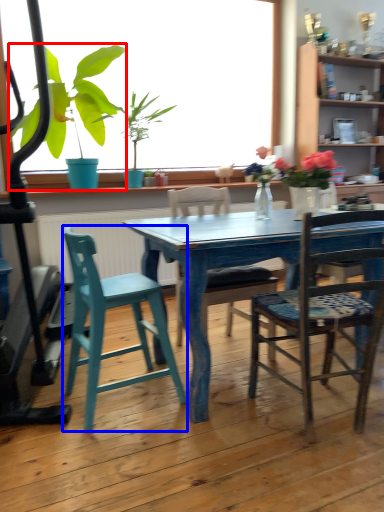
Question: Which object appears farthest to the camera in this image, houseplant (highlighted by a red box) or chair (highlighted by a blue box)?

Choices:
 (A) houseplant
 (B) chair

Answer: (A)